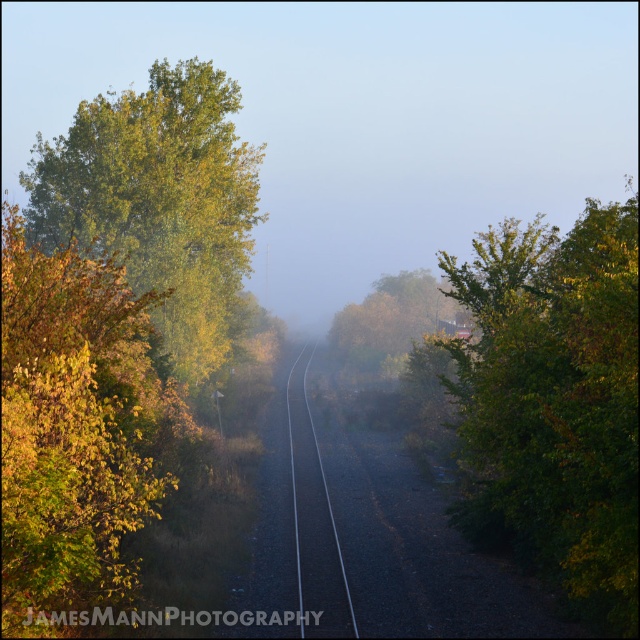
Question: Among these points, which one is farthest from the camera?

Choices:
 (A) (202, 173)
 (B) (384, 301)
 (C) (570, 525)

Answer: (B)

Question: Is green leafy tree at left further to the viewer compared to golden foliage at center?

Choices:
 (A) no
 (B) yes

Answer: (A)

Question: Is foggy mist at center further to the viewer compared to golden foliage at left?

Choices:
 (A) no
 (B) yes

Answer: (B)

Question: Based on their relative distances, which object is farther from the golden foliage at center?

Choices:
 (A) foggy mist at center
 (B) black asphalt train track at center
 (C) green leafy tree at right

Answer: (A)

Question: Can you confirm if golden foliage at left is wider than golden foliage at center?

Choices:
 (A) yes
 (B) no

Answer: (B)

Question: Among these objects, which one is farthest from the camera?

Choices:
 (A) green leafy tree at left
 (B) golden foliage at center
 (C) golden foliage at left
 (D) black asphalt train track at center

Answer: (B)